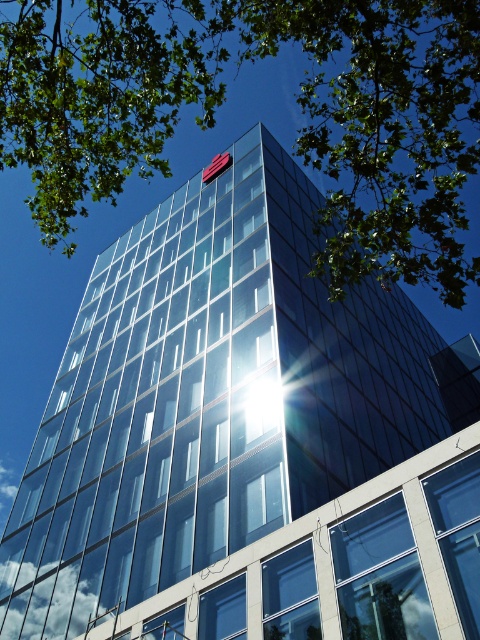
Question: Can you confirm if green leafy tree at upper left is thinner than red fabric flag at upper center?

Choices:
 (A) yes
 (B) no

Answer: (B)

Question: Which object appears closest to the camera in this image?

Choices:
 (A) red fabric flag at upper center
 (B) green leafy tree at upper left

Answer: (B)

Question: Can you confirm if green leafy tree at upper left is positioned below red fabric flag at upper center?

Choices:
 (A) yes
 (B) no

Answer: (B)

Question: Is green leafy tree at upper left smaller than red fabric flag at upper center?

Choices:
 (A) no
 (B) yes

Answer: (A)

Question: Which point is closer to the camera taking this photo?

Choices:
 (A) (12, 116)
 (B) (216, 156)

Answer: (A)